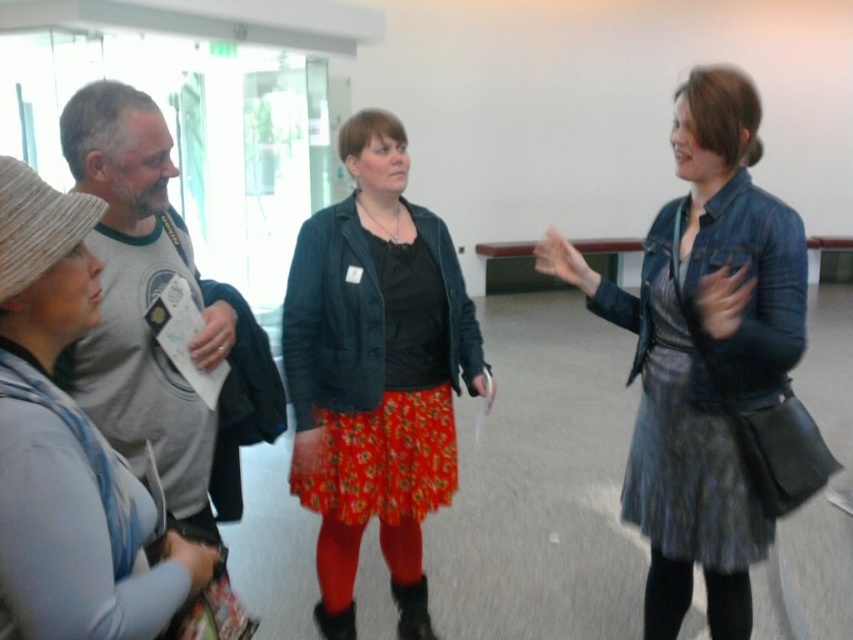
Question: Can you confirm if denim jacket at center is positioned above gray cotton t-shirt at left?

Choices:
 (A) no
 (B) yes

Answer: (A)

Question: Based on their relative distances, which object is nearer to the denim jacket at center?

Choices:
 (A) floral skirt at center
 (B) black tights at lower right

Answer: (B)

Question: Does floral skirt at center appear over black tights at lower right?

Choices:
 (A) yes
 (B) no

Answer: (A)

Question: Is gray cotton t-shirt at left further to camera compared to black tights at lower right?

Choices:
 (A) no
 (B) yes

Answer: (A)

Question: Which point is closer to the camera?

Choices:
 (A) (393, 164)
 (B) (711, 636)
 (C) (207, 314)
 (D) (674, 326)

Answer: (C)

Question: Which is farther from the gray cotton t-shirt at left?

Choices:
 (A) denim jacket at center
 (B) floral skirt at center

Answer: (A)